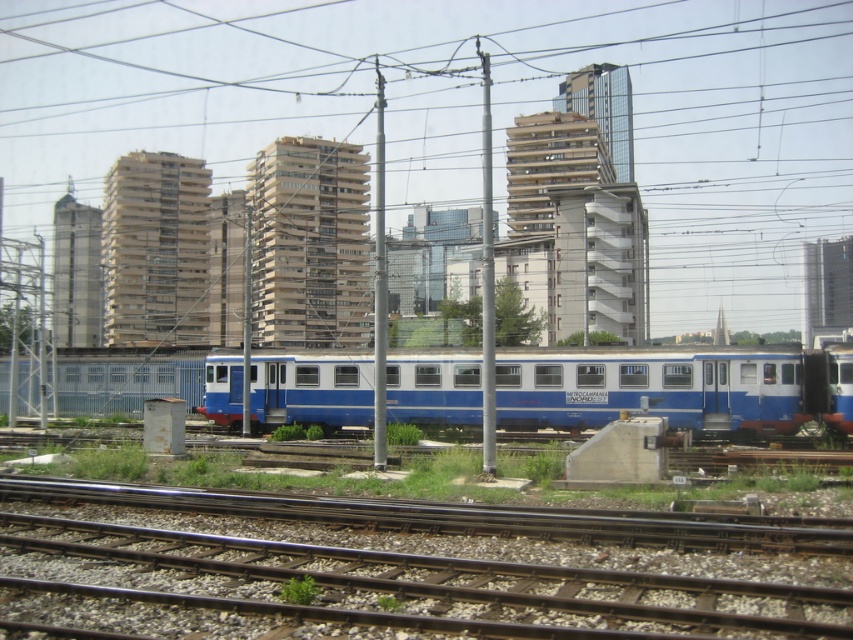
You are a train engineer planning to navigate a train through the urban railway scene. You notice a specific point at coordinates point (378, 588). What type of track material is present at that location?

The point (378, 588) has smooth steel tracks at center, so the track material at that location is smooth steel tracks.